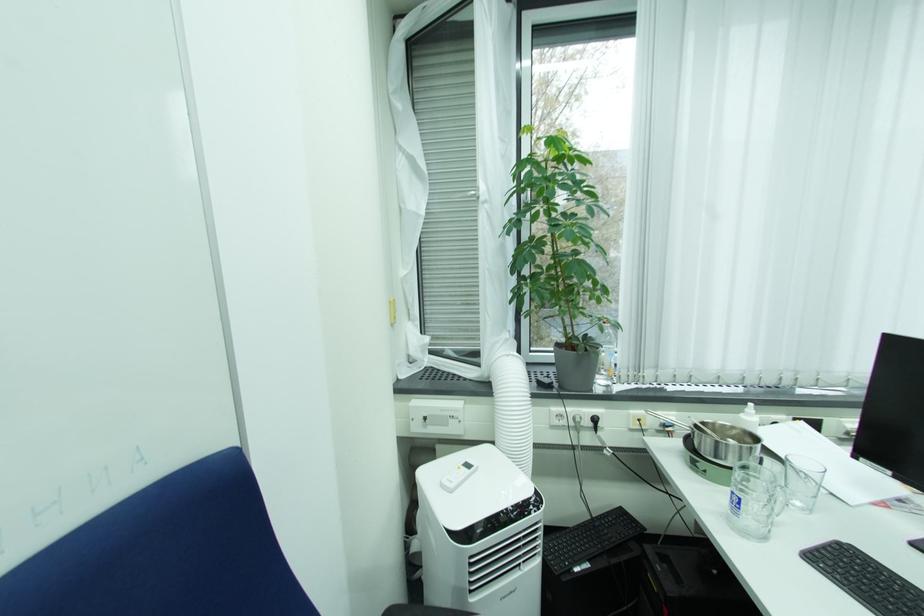
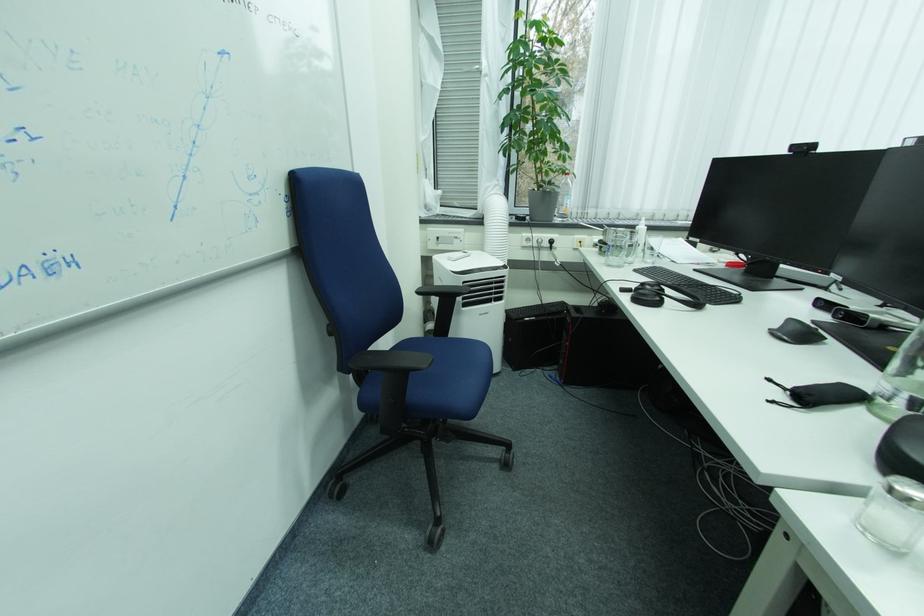
Find the pixel in the second image that matches pixel 556 387 in the first image.

(530, 220)